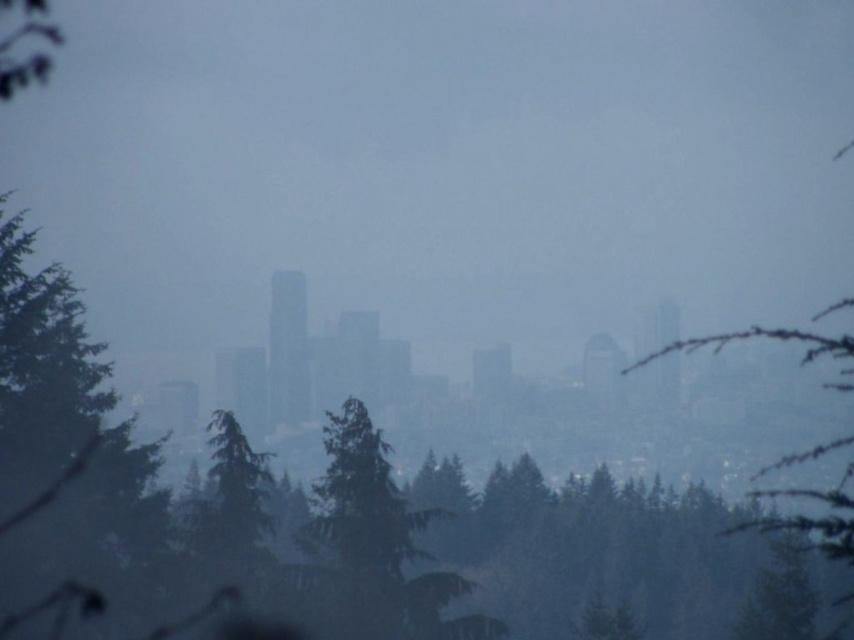
You are standing in a foggy city park and see a point marked at coordinates [373,545]. Based on the scene description, which object from the list does this point belong to?

The point at [373,545] is on the green textured tree at center.

You are standing in a foggy forest looking at the city skyline. You notice two trees, the green textured tree at center and the green matte tree at upper left. Which tree appears closer to you?

The green textured tree at center appears closer to you than the green matte tree at upper left.

You are an urban planner assessing a proposed pathway between the green textured tree at center and the green matte tree at upper left. Based on their positions, which tree would you designate as the starting point if the path is to lead towards the city skyline?

The green matte tree at upper left should be the starting point because it is positioned to the left of the green textured tree at center, meaning the path would naturally lead towards the city skyline located beyond the trees.